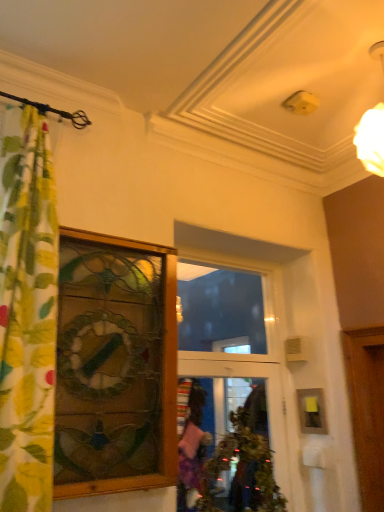
Question: Considering the relative positions of clear glass door at center and transparent glass window at center in the image provided, is clear glass door at center to the left of transparent glass window at center from the viewer's perspective?

Choices:
 (A) no
 (B) yes

Answer: (B)

Question: From a real-world perspective, does clear glass door at center sit lower than transparent glass window at center?

Choices:
 (A) no
 (B) yes

Answer: (B)

Question: Is clear glass door at center to the right of transparent glass window at center from the viewer's perspective?

Choices:
 (A) no
 (B) yes

Answer: (A)

Question: Is clear glass door at center with transparent glass window at center?

Choices:
 (A) no
 (B) yes

Answer: (A)

Question: Does clear glass door at center have a larger size compared to transparent glass window at center?

Choices:
 (A) no
 (B) yes

Answer: (B)

Question: Can you confirm if clear glass door at center is smaller than transparent glass window at center?

Choices:
 (A) yes
 (B) no

Answer: (B)

Question: Is transparent glass window at center shorter than wooden picture frame at right?

Choices:
 (A) no
 (B) yes

Answer: (A)

Question: Is transparent glass window at center oriented away from wooden picture frame at right?

Choices:
 (A) yes
 (B) no

Answer: (B)

Question: Does transparent glass window at center have a greater height compared to wooden picture frame at right?

Choices:
 (A) yes
 (B) no

Answer: (A)

Question: Is transparent glass window at center facing towards wooden picture frame at right?

Choices:
 (A) no
 (B) yes

Answer: (A)

Question: Can you confirm if transparent glass window at center is smaller than wooden picture frame at right?

Choices:
 (A) yes
 (B) no

Answer: (B)

Question: Is wooden picture frame at right surrounded by transparent glass window at center?

Choices:
 (A) yes
 (B) no

Answer: (B)

Question: From a real-world perspective, is green floral fabric curtain at left over wooden stained glass window at left?

Choices:
 (A) no
 (B) yes

Answer: (B)